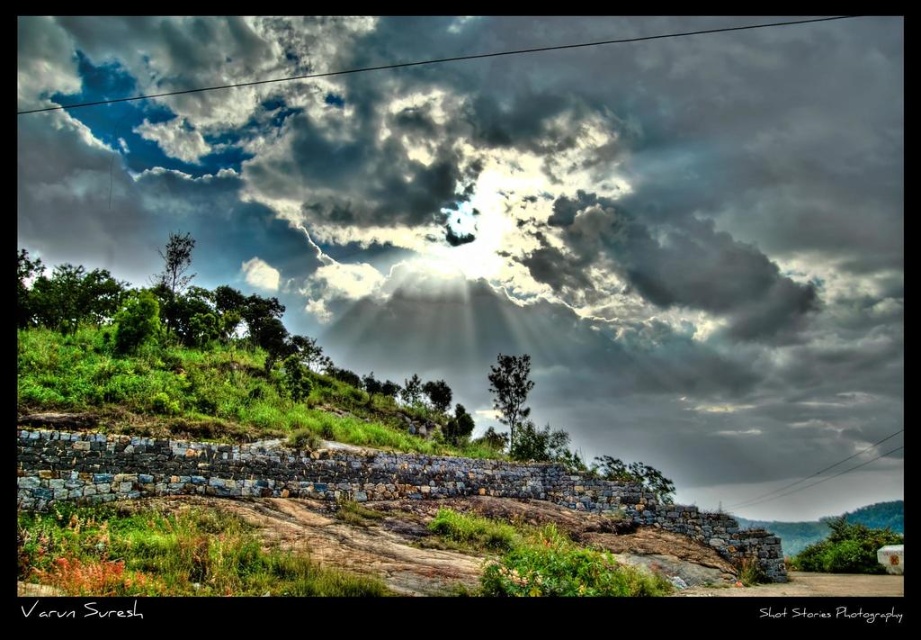
You are standing at the base of the slope looking up towards the hillside. There are two points marked on the image. The first point is at coordinates point (843, 518) and the second is at point (507, 436). Which point is closer to your current position?

Point (843, 518) is further to the viewer than point (507, 436), so the point closer to your current position is point (507, 436).

You are an astronomer analyzing the image. You need to determine the position of the cloudy sky at upper center. What are its coordinates?

The cloudy sky at upper center is located at coordinates (520, 211).